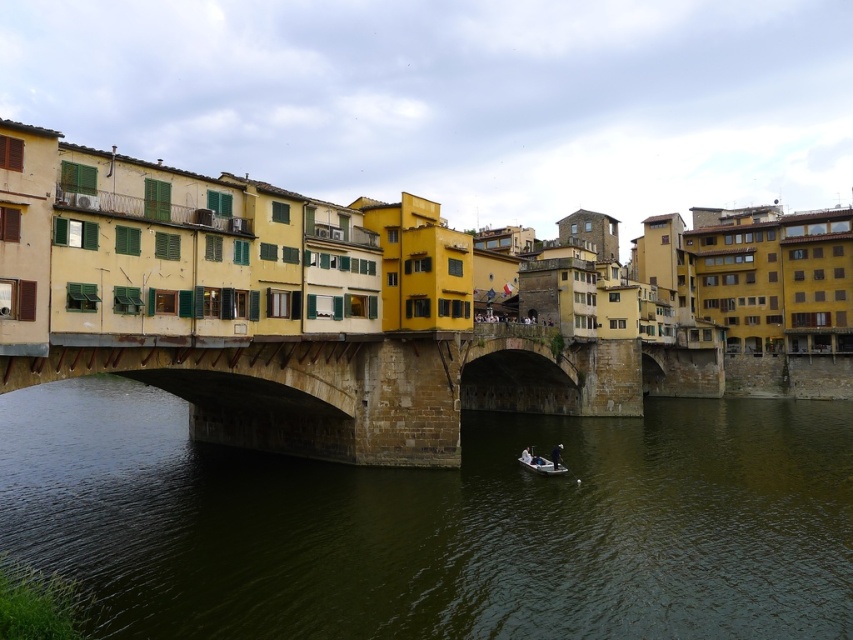
You are standing at the base of the historic stone bridge and want to take a photo of the point located at coordinate point (193, 628). Your camera has a maximum zoom range of 50 meters. Can you capture the point in your photo?

The distance of point (193, 628) from the viewer is 41.62 meters, which is within the camera maximum zoom range of 50 meters. Yes, you can capture the point in your photo.